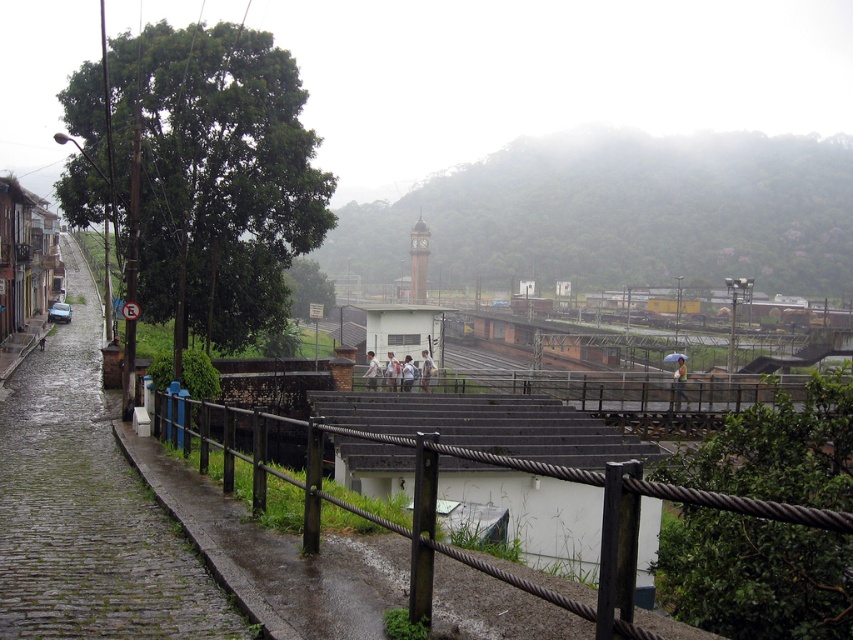
Does white cotton shirt at center have a greater width compared to light brown leather jacket at center?

Yes, white cotton shirt at center is wider than light brown leather jacket at center.

Between point (369, 356) and point (427, 381), which one is positioned in front?

Point (427, 381) is more forward.

Identify the location of white cotton shirt at center. This screenshot has width=853, height=640. (370, 371).

Who is positioned more to the right, green leafy hillside at center or light brown leather jacket at center?

From the viewer's perspective, green leafy hillside at center appears more on the right side.

Can you confirm if green leafy hillside at center is positioned above light brown leather jacket at center?

Yes.

Who is more forward, (410, 218) or (432, 371)?

Point (432, 371)

Where is `green leafy hillside at center`? The image size is (853, 640). green leafy hillside at center is located at coordinates (622, 214).

Is wooden at lower center to the left of yellow fabric umbrella at center from the viewer's perspective?

Yes, wooden at lower center is to the left of yellow fabric umbrella at center.

Image resolution: width=853 pixels, height=640 pixels. Find the location of `wooden at lower center`. wooden at lower center is located at coordinates (670, 531).